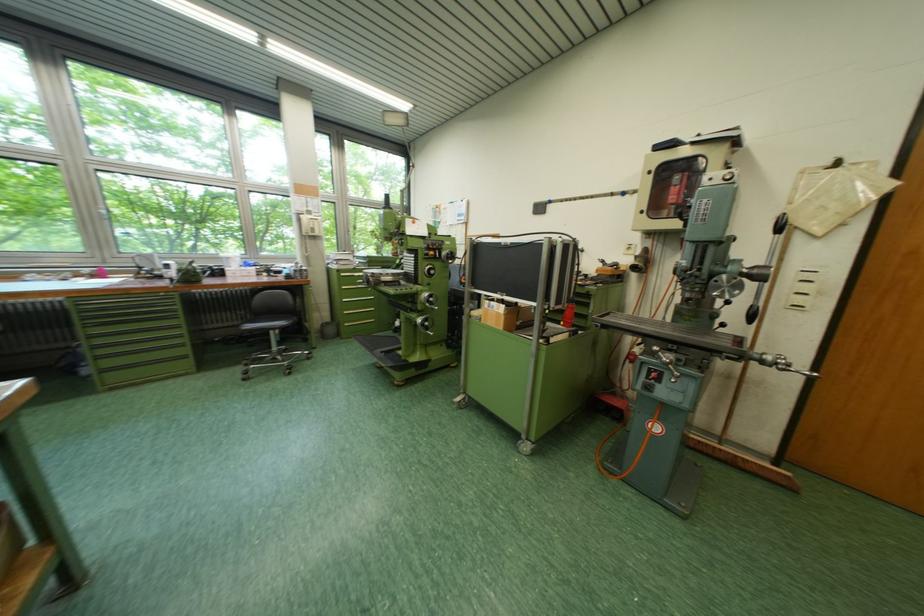
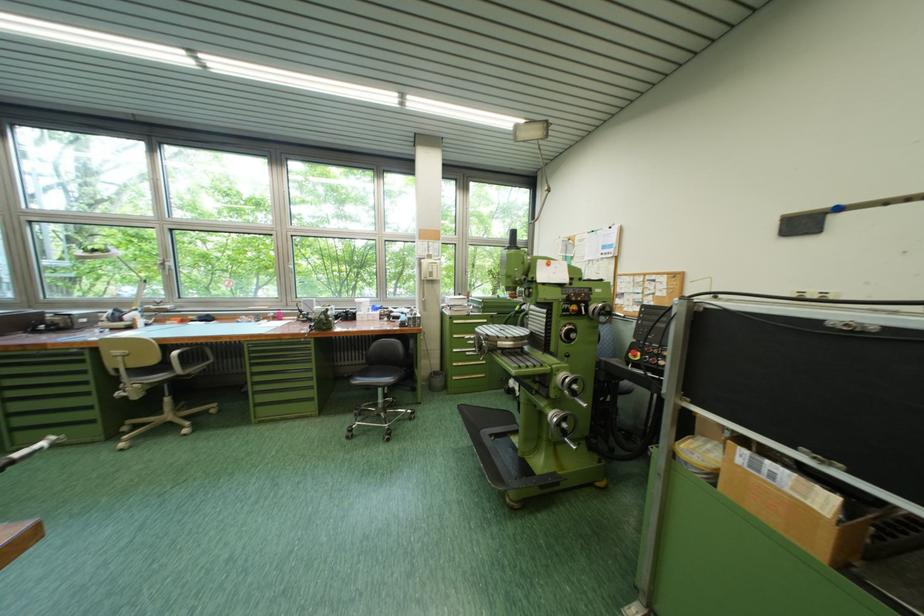
Question: How did the camera likely rotate?

Choices:
 (A) Left
 (B) Right
 (C) Up
 (D) Down

Answer: (A)